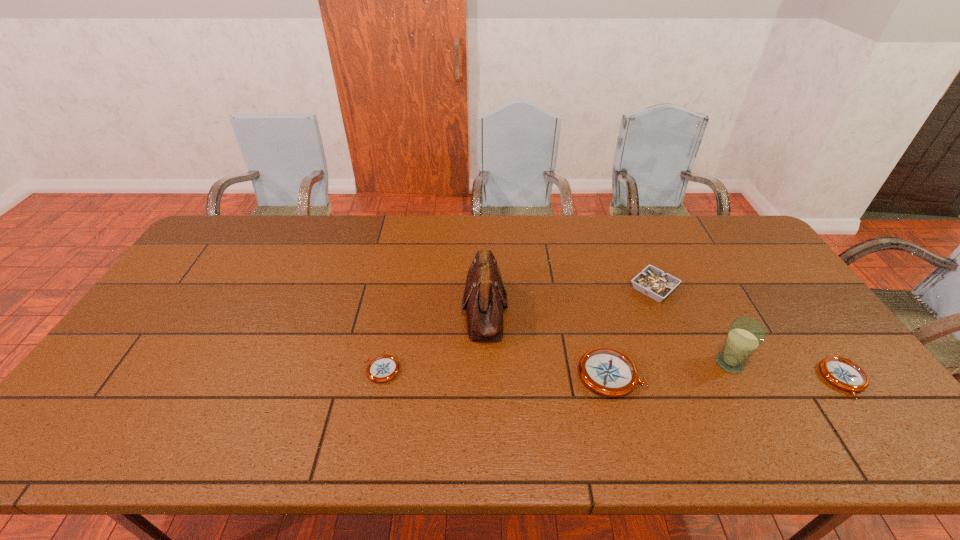
You are a GUI agent. You are given a task and a screenshot of the screen. Output one action in this format:
    pyautogui.click(x=<x>, y=<y>)
    Task: Click on the vacant space at the left edge of the desktop
    
    Given the screenshot: What is the action you would take?
    pyautogui.click(x=185, y=343)

Identify the location of vacant space at the right edge. The width and height of the screenshot is (960, 540). (800, 369).

I want to click on free space between the leftmost compass and the ashtray, so click(x=518, y=329).

The width and height of the screenshot is (960, 540). I want to click on free spot between the leftmost object and the tallest compass, so click(x=496, y=373).

Locate an element on the screen. This screenshot has width=960, height=540. unoccupied area between the leftmost compass and the fourth object from right to left is located at coordinates (496, 373).

The image size is (960, 540). I want to click on unoccupied area between the glass and the ashtray, so click(691, 326).

Find the location of `vacant area that lies between the shortest compass and the shoulder bag`. vacant area that lies between the shortest compass and the shoulder bag is located at coordinates (434, 340).

In order to click on free space that is in between the second compass from left to right and the fifth object from right to left in this screenshot , I will do `click(548, 342)`.

Find the location of a particular element. This screenshot has width=960, height=540. vacant space that's between the glass and the second object from left to right is located at coordinates (607, 336).

The image size is (960, 540). In order to click on unoccupied area between the fifth shortest object and the ashtray in this screenshot , I will do `click(691, 326)`.